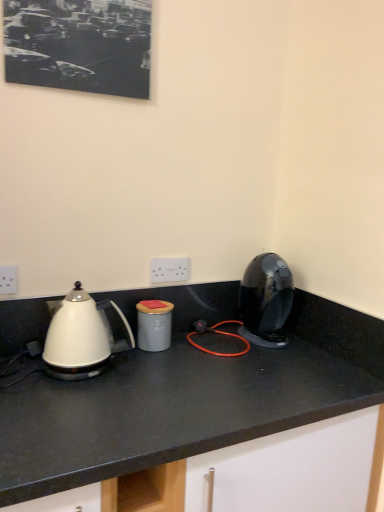
The image size is (384, 512). Find the location of `free spot in front of shiny black coffee machine at right`. free spot in front of shiny black coffee machine at right is located at coordinates (288, 364).